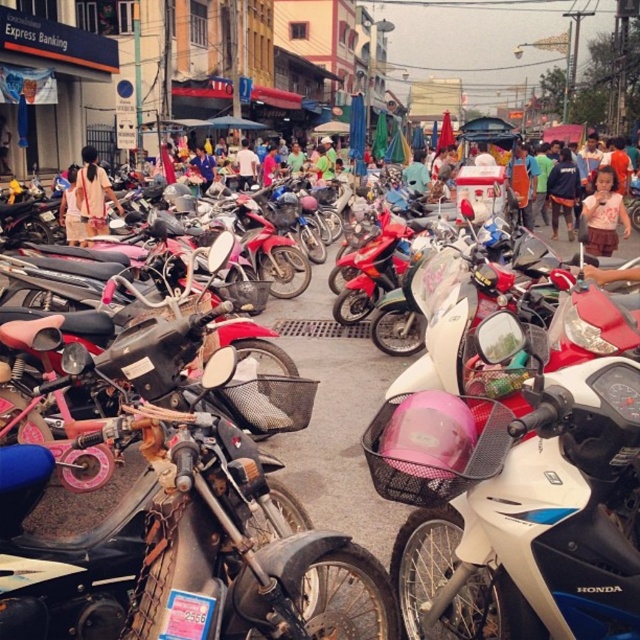
Question: In this image, where is rusty metal motorcycle at center located relative to light pink fabric dress at left?

Choices:
 (A) right
 (B) left

Answer: (A)

Question: Does rusty metal motorcycle at center appear on the right side of light pink fabric dress at left?

Choices:
 (A) yes
 (B) no

Answer: (A)

Question: Estimate the real-world distances between objects in this image. Which object is farther from the rusty metal motorcycle at center?

Choices:
 (A) dark blue shirt at center
 (B) light pink fabric dress at left
 (C) white matte motorcycle at center

Answer: (A)

Question: Which object is the farthest from the light pink fabric dress at left?

Choices:
 (A) dark blue shirt at center
 (B) rusty metal motorcycle at center
 (C) light blue shirt at center
 (D) white matte motorcycle at center

Answer: (A)

Question: Which object is closer to the camera taking this photo?

Choices:
 (A) pink fabric dress at right
 (B) light blue shirt at center
 (C) dark blue shirt at center

Answer: (A)

Question: Does white matte motorcycle at center have a smaller size compared to light blue shirt at center?

Choices:
 (A) no
 (B) yes

Answer: (B)